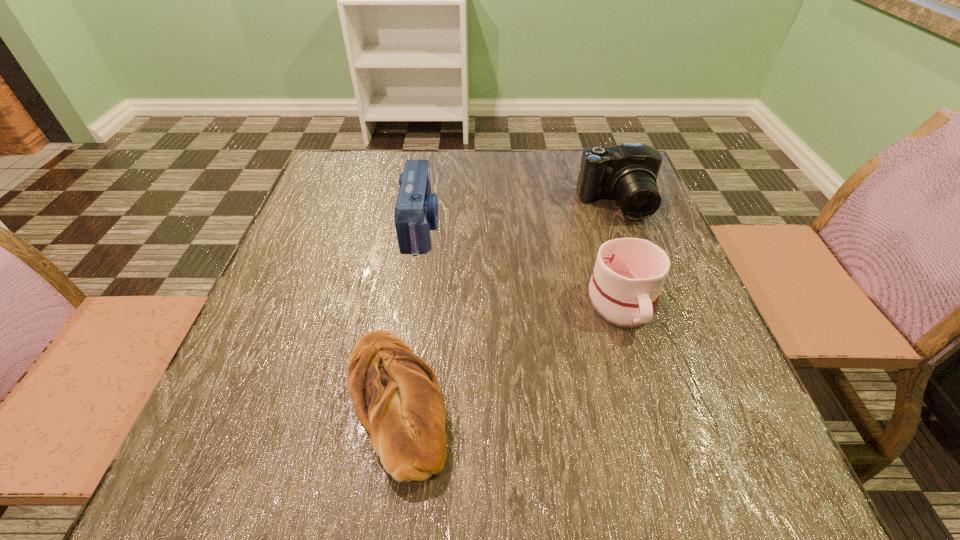
I want to click on the right camera, so click(x=627, y=173).

The width and height of the screenshot is (960, 540). I want to click on the left camera, so click(416, 212).

The image size is (960, 540). What are the coordinates of `mug` in the screenshot? It's located at (629, 273).

Locate an element on the screen. The image size is (960, 540). the shortest object is located at coordinates (396, 395).

Locate an element on the screen. The width and height of the screenshot is (960, 540). free point located on the lens of the right camera is located at coordinates (660, 322).

Locate an element on the screen. vacant region located 0.290m on the lens of the left camera is located at coordinates (563, 227).

The image size is (960, 540). I want to click on vacant space located 0.180m on the side with the handle of the second shortest object, so click(x=662, y=434).

The image size is (960, 540). I want to click on free spot located on the right of the bread, so click(629, 402).

Identify the location of object situated at the far edge. (627, 173).

Find the location of a particular element. object that is at the near edge is located at coordinates (396, 395).